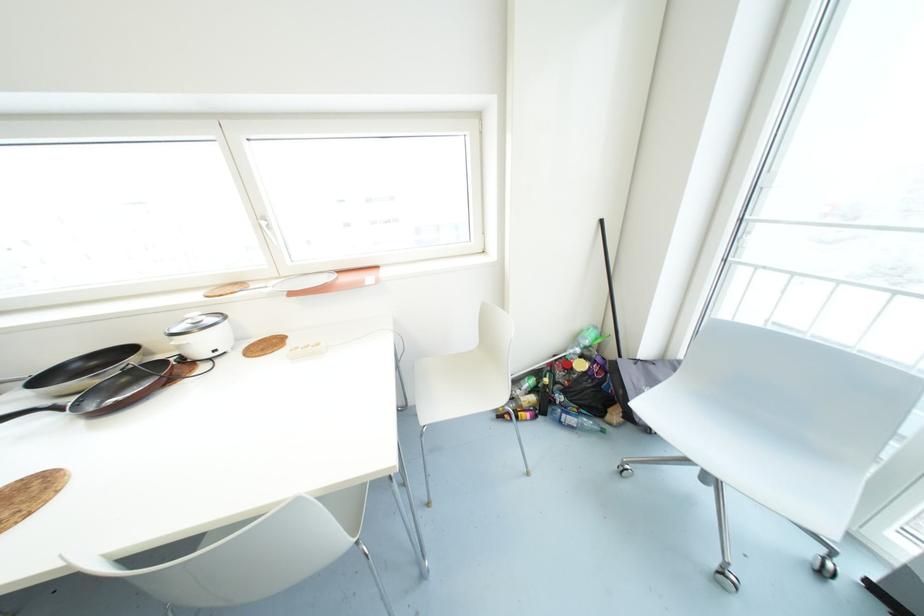
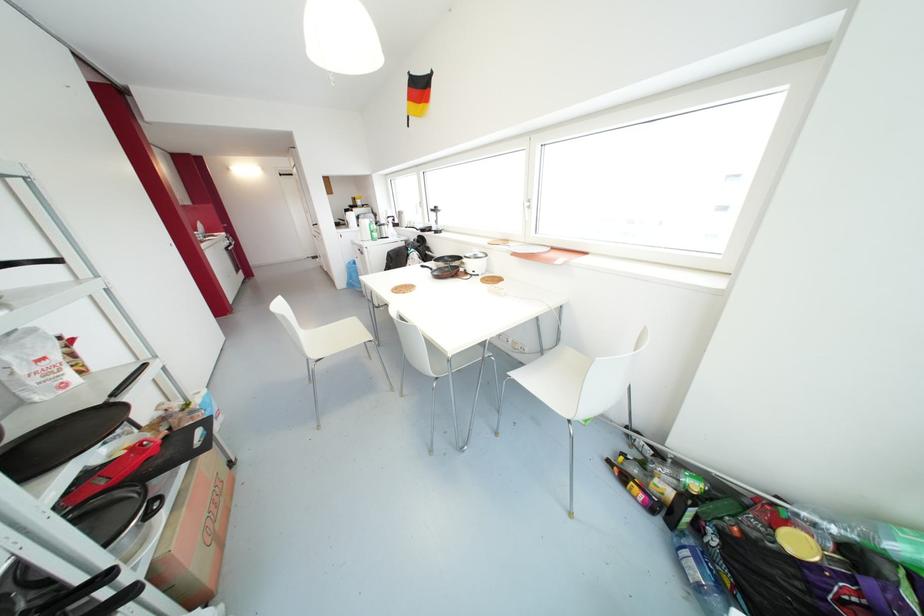
Question: I am providing you with two images of the same scene from different viewpoints. After the viewpoint changes to image2, which objects are now occluded?

Choices:
 (A) white cup
 (B) cardboard box
 (C) silver cabinet handle
 (D) none of these

Answer: (D)